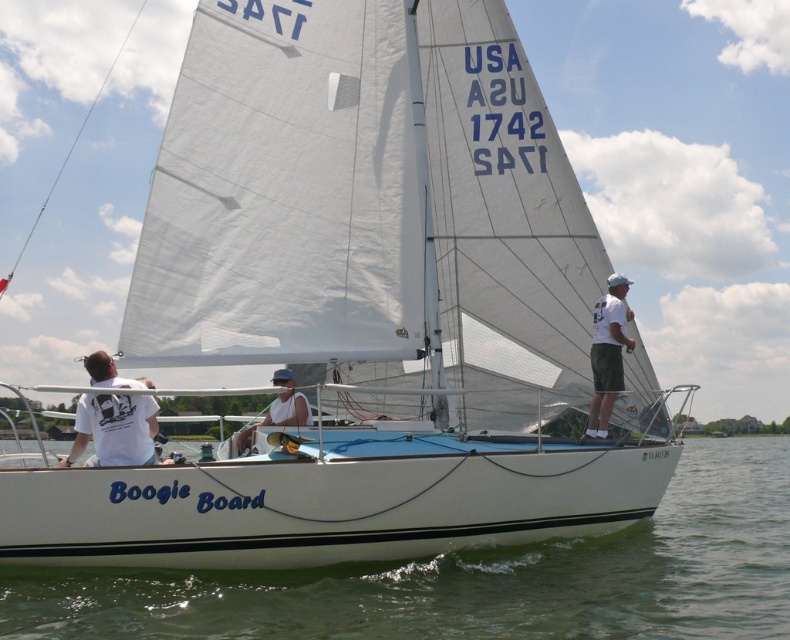
You are a photographer trying to capture a closeup of the white matte sunglasses at center and the white matte tank top at center. Since you want to focus on the sunglasses, which object should you zoom in on more to ensure it doesn

The white matte sunglasses at center occupies less space than the white matte tank top at center, so you should zoom in more on the white matte sunglasses at center to ensure it is the focus.

You are on the deck of the sailboat named Boogie Board. You need to locate the white water at center. Where should you look relative to the point marked by coordinates (478, 579)?

The point marked by coordinates (478, 579) is exactly where the white water at center is located.

You are a passenger on the sailboat named Boogie Board. You notice two points marked on the deck. The first point is at coordinate point [277,388] and the second is at point [111,408]. Which point is closer to you as you stand on the deck?

Point [277,388] is closer to you because it is further to the viewer than point [111,408].